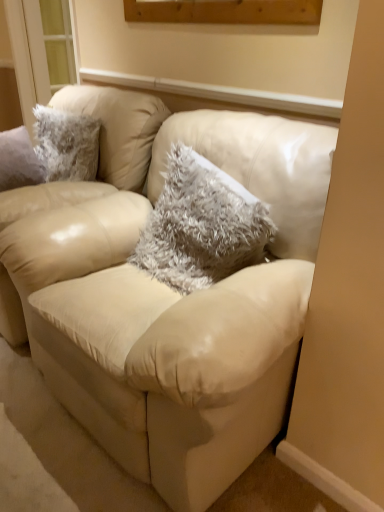
Question: Considering the relative sizes of fuzzy gray pillow at center and beige leather chair at center in the image provided, is fuzzy gray pillow at center taller than beige leather chair at center?

Choices:
 (A) yes
 (B) no

Answer: (B)

Question: Is fuzzy gray pillow at center with beige leather chair at center?

Choices:
 (A) no
 (B) yes

Answer: (A)

Question: Is fuzzy gray pillow at center aimed at beige leather chair at center?

Choices:
 (A) yes
 (B) no

Answer: (B)

Question: Considering the relative sizes of fuzzy gray pillow at center and beige leather chair at center in the image provided, is fuzzy gray pillow at center wider than beige leather chair at center?

Choices:
 (A) yes
 (B) no

Answer: (B)

Question: Is fuzzy gray pillow at center positioned in front of beige leather chair at center?

Choices:
 (A) yes
 (B) no

Answer: (A)

Question: Considering the relative sizes of fuzzy gray pillow at center and beige leather chair at center in the image provided, is fuzzy gray pillow at center thinner than beige leather chair at center?

Choices:
 (A) no
 (B) yes

Answer: (B)

Question: From the image's perspective, is beige leather couch at center beneath beige leather chair at center?

Choices:
 (A) no
 (B) yes

Answer: (B)

Question: Is beige leather couch at center aimed at beige leather chair at center?

Choices:
 (A) no
 (B) yes

Answer: (A)

Question: Is beige leather couch at center far from beige leather chair at center?

Choices:
 (A) no
 (B) yes

Answer: (A)

Question: From a real-world perspective, is beige leather couch at center physically above beige leather chair at center?

Choices:
 (A) yes
 (B) no

Answer: (B)

Question: Is beige leather couch at center with beige leather chair at center?

Choices:
 (A) no
 (B) yes

Answer: (A)

Question: Does beige leather couch at center appear on the right side of beige leather chair at center?

Choices:
 (A) yes
 (B) no

Answer: (A)

Question: Is beige leather couch at center closer to the viewer compared to fuzzy gray pillow at center?

Choices:
 (A) yes
 (B) no

Answer: (A)